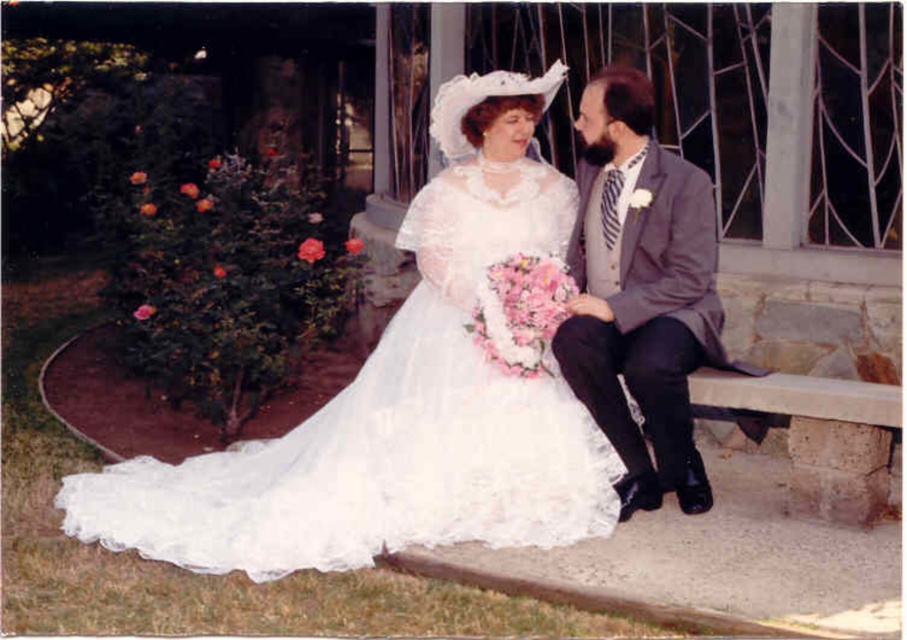
In the scene shown: You are a photographer standing at point [372,435] in the scene. The couple is seated on a stone bench outside a building with a glass door and metal bars. You need to capture a photo of both the woman in the white wedding gown and the man in the dark gray suit. Can you fit both subjects into the frame without moving your position? Explain your reasoning.

The couple are 4.12 meters apart. Since you are positioned at point [372,435], which is likely between them, the distance between them may be too great to capture both in a single frame without moving. However, depending on the camera lens and framing, it might be possible. But according to the given information, the distance is 4.12 meters, so it might be challenging to fit both into the frame without moving.

You are a photographer at the wedding scene. You need to place a floral arrangement at the point marked by coordinates point (391, 428). What object is located at that point?

The point (391, 428) indicates the white lace dress at center.

Based on the photo, you are a photographer setting up for a wedding photo. You need to adjust the lighting so that both the white lace dress at center and the gray wool suit at right are well illuminated. Considering their heights, which one might require a shorter light stand to ensure proper lighting?

The white lace dress at center has a lesser height compared to the gray wool suit at right, so the shorter light stand should be used for the white lace dress at center to match its height.